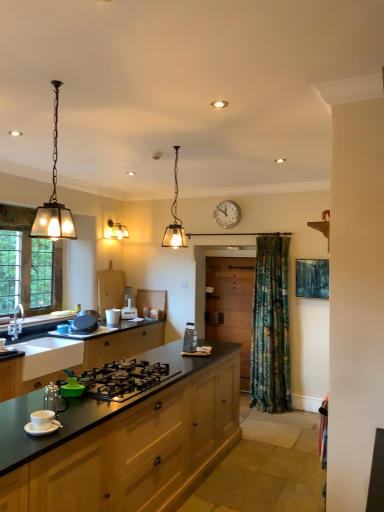
Locate an element on the screen. This screenshot has width=384, height=512. metallic silver tea pot at lower left is located at coordinates (54, 399).

What do you see at coordinates (54, 399) in the screenshot? I see `metallic silver tea pot at lower left` at bounding box center [54, 399].

You are a GUI agent. You are given a task and a screenshot of the screen. Output one action in this format:
    pyautogui.click(x=<x>, y=<y>)
    Task: Click on the white glossy cup at center, placed as the second appliance when sorted from left to right
    
    Given the screenshot: What is the action you would take?
    pyautogui.click(x=113, y=316)

What is the approximate height of white ceramic cup at lower left, acting as the second appliance starting from the right?

It is 3.08 inches.

I want to click on white plastic clock at upper center, so click(x=227, y=214).

From the picture: How many degrees apart are the facing directions of white ceramic cup at lower left, acting as the second appliance starting from the right, and brushed metal faucet at left?

The facing directions of white ceramic cup at lower left, acting as the second appliance starting from the right, and brushed metal faucet at left are 5.66 degrees apart.

From the image's perspective, is white ceramic cup at lower left, the 5th appliance from the back, over brushed metal faucet at left?

No.

In the scene shown: Which of these two, white ceramic cup at lower left, acting as the second appliance starting from the right, or brushed metal faucet at left, is thinner?

white ceramic cup at lower left, acting as the second appliance starting from the right, is thinner.

Who is bigger, white ceramic cup at lower left, which is the first appliance in front-to-back order, or brushed metal faucet at left?

brushed metal faucet at left.

Where is `sink that is behind the white ceramic cup at lower left, acting as the second appliance starting from the right`? The height and width of the screenshot is (512, 384). sink that is behind the white ceramic cup at lower left, acting as the second appliance starting from the right is located at coordinates (49, 355).

From the picture: Who is more distant, white matte sink at lower left or white ceramic cup at lower left, the 5th appliance from the back?

white matte sink at lower left.

From the image's perspective, relative to white ceramic cup at lower left, the 5th appliance from the back, is white matte sink at lower left above or below?

white matte sink at lower left is below white ceramic cup at lower left, the 5th appliance from the back.

Considering the positions of objects clear glass window at left and white plastic clock at upper center in the image provided, who is more to the right, clear glass window at left or white plastic clock at upper center?

From the viewer's perspective, white plastic clock at upper center appears more on the right side.

Between point (53, 270) and point (217, 207), which one is positioned in front?

Positioned in front is point (53, 270).

Could you tell me if clear glass window at left is facing white plastic clock at upper center?

No, clear glass window at left is not facing towards white plastic clock at upper center.

Based on the photo, does clear glass window at left lie in front of white plastic clock at upper center?

Yes, clear glass window at left is closer to the viewer.

Does satin silver grater at center, which is counted as the 5th appliance, starting from the left, have a larger size compared to white glossy cup at center, which ranks as the 4th appliance in right-to-left order?

No.

Is satin silver grater at center, the 4th appliance viewed from the back, turned away from white glossy cup at center, placed as the second appliance when sorted from left to right?

satin silver grater at center, the 4th appliance viewed from the back, does not have its back to white glossy cup at center, placed as the second appliance when sorted from left to right.

How much distance is there between satin silver grater at center, which is counted as the 5th appliance, starting from the left, and white glossy cup at center, which ranks as the 4th appliance in right-to-left order?

The distance of satin silver grater at center, which is counted as the 5th appliance, starting from the left, from white glossy cup at center, which ranks as the 4th appliance in right-to-left order, is 96.53 centimeters.

Between satin silver grater at center, which is the first appliance in right-to-left order, and white glossy cup at center, which appears as the fourth appliance when viewed from the front, which one has smaller width?

Thinner between the two is satin silver grater at center, which is the first appliance in right-to-left order.

In terms of height, does black matte gas stove at center look taller or shorter compared to white ceramic cup at lower left, arranged as the 4th appliance when viewed from the left?

black matte gas stove at center is taller than white ceramic cup at lower left, arranged as the 4th appliance when viewed from the left.

Where is `the 1st appliance above the black matte gas stove at center (from a real-world perspective)`? the 1st appliance above the black matte gas stove at center (from a real-world perspective) is located at coordinates (43, 420).

Would you consider black matte gas stove at center to be distant from white ceramic cup at lower left, arranged as the 4th appliance when viewed from the left?

No, black matte gas stove at center is in close proximity to white ceramic cup at lower left, arranged as the 4th appliance when viewed from the left.

Is matte glass pendant light at upper left, arranged as the second lamp when viewed from the left, to the right of metallic silver tea pot at lower left from the viewer's perspective?

Incorrect, matte glass pendant light at upper left, arranged as the second lamp when viewed from the left, is not on the right side of metallic silver tea pot at lower left.

Is matte glass pendant light at upper left, arranged as the second lamp when viewed from the left, placed right next to metallic silver tea pot at lower left?

No, matte glass pendant light at upper left, arranged as the second lamp when viewed from the left, is not with metallic silver tea pot at lower left.

Considering the relative sizes of matte glass pendant light at upper left, arranged as the second lamp when viewed from the left, and metallic silver tea pot at lower left in the image provided, is matte glass pendant light at upper left, arranged as the second lamp when viewed from the left, taller than metallic silver tea pot at lower left?

Correct, matte glass pendant light at upper left, arranged as the second lamp when viewed from the left, is much taller as metallic silver tea pot at lower left.

From a real-world perspective, does matte glass pendant light at upper left, marked as the 1th lamp in a right-to-left arrangement, sit lower than metallic silver tea pot at lower left?

No, from a real-world perspective, matte glass pendant light at upper left, marked as the 1th lamp in a right-to-left arrangement, is not below metallic silver tea pot at lower left.

Locate an element on the screen. the 2nd appliance positioned above the wooden cabinet at center, positioned as the 3th cabinetry in front-to-back order (from a real-world perspective) is located at coordinates (84, 324).

From a real-world perspective, is wooden cabinet at center, which ranks as the 1th cabinetry in back-to-front order, above or below matte black frying pan at left, the 1th appliance viewed from the left?

wooden cabinet at center, which ranks as the 1th cabinetry in back-to-front order, is below matte black frying pan at left, the 1th appliance viewed from the left.

Between wooden cabinet at center, positioned as the 3th cabinetry in front-to-back order, and matte black frying pan at left, the third appliance from the front, which one has larger size?

wooden cabinet at center, positioned as the 3th cabinetry in front-to-back order, is bigger.

Consider the image. Considering the sizes of objects wooden cabinet at center, positioned as the 3th cabinetry in front-to-back order, and matte black frying pan at left, the third appliance from the back, in the image provided, who is thinner, wooden cabinet at center, positioned as the 3th cabinetry in front-to-back order, or matte black frying pan at left, the third appliance from the back,?

With smaller width is wooden cabinet at center, positioned as the 3th cabinetry in front-to-back order.

The image size is (384, 512). Find the location of `the 4th appliance positioned below the brushed metal faucet at left (from a real-world perspective)`. the 4th appliance positioned below the brushed metal faucet at left (from a real-world perspective) is located at coordinates (43, 420).

Where is `sink below the white ceramic cup at lower left, arranged as the 4th appliance when viewed from the left (from the image's perspective)`? sink below the white ceramic cup at lower left, arranged as the 4th appliance when viewed from the left (from the image's perspective) is located at coordinates coord(49,355).

Estimate the real-world distances between objects in this image. Which object is further from white plastic blender at center, the third appliance viewed from the right, matte glass pendant light at center or matte glass pendant light at upper left, which ranks as the second lamp in back-to-front order?

The object further to white plastic blender at center, the third appliance viewed from the right, is matte glass pendant light at upper left, which ranks as the second lamp in back-to-front order.

Considering their positions, is matte black countertop at lower left, the 3th cabinetry in the back-to-front sequence, positioned further to matte glass pendant light at upper center, positioned as the 1th lamp in back-to-front order, than brushed metal faucet at left?

matte black countertop at lower left, the 3th cabinetry in the back-to-front sequence, is further to matte glass pendant light at upper center, positioned as the 1th lamp in back-to-front order.

From the image, which object appears to be farther from matte black countertop at lower left, the 3th cabinetry in the back-to-front sequence, satin silver grater at center, the 4th appliance viewed from the back, or white glossy cup at center, placed as the second appliance when sorted from left to right?

white glossy cup at center, placed as the second appliance when sorted from left to right, lies further to matte black countertop at lower left, the 3th cabinetry in the back-to-front sequence, than the other object.

Which object lies nearer to the anchor point matte black frying pan at left, the third appliance from the front, white glossy cup at center, which ranks as the 4th appliance in right-to-left order, or wooden cabinet at center, which ranks as the 1th cabinetry in back-to-front order?

white glossy cup at center, which ranks as the 4th appliance in right-to-left order, is closer to matte black frying pan at left, the third appliance from the front.

Estimate the real-world distances between objects in this image. Which object is closer to wooden cabinet at center, which ranks as the 1th cabinetry in back-to-front order, clear glass window at left or matte black countertop at lower left, the second cabinetry in the back-to-front sequence?

matte black countertop at lower left, the second cabinetry in the back-to-front sequence, lies closer to wooden cabinet at center, which ranks as the 1th cabinetry in back-to-front order, than the other object.

When comparing their distances from matte glass pendant light at upper left, arranged as the second lamp when viewed from the left, does white glossy cup at center, placed as the second appliance when sorted from left to right, or matte glass pendant light at center seem further?

white glossy cup at center, placed as the second appliance when sorted from left to right, lies further to matte glass pendant light at upper left, arranged as the second lamp when viewed from the left, than the other object.

When comparing their distances from matte glass pendant light at upper center, positioned as the 1th lamp in back-to-front order, does matte glass pendant light at center or matte glass pendant light at upper left, arranged as the second lamp when viewed from the left, seem further?

matte glass pendant light at upper left, arranged as the second lamp when viewed from the left, is positioned further to the anchor matte glass pendant light at upper center, positioned as the 1th lamp in back-to-front order.

When comparing their distances from satin silver grater at center, which is counted as the 5th appliance, starting from the left, does white ceramic cup at lower left, which is the first appliance in front-to-back order, or white matte sink at lower left seem closer?

Based on the image, white matte sink at lower left appears to be nearer to satin silver grater at center, which is counted as the 5th appliance, starting from the left.

You are a GUI agent. You are given a task and a screenshot of the screen. Output one action in this format:
    pyautogui.click(x=<x>, y=<y>)
    Task: Click on the gas stove between matte glass pendant light at center and matte black countertop at lower left, the second cabinetry positioned from the front, in the up-down direction
    The height and width of the screenshot is (512, 384).
    Given the screenshot: What is the action you would take?
    [123, 379]

The width and height of the screenshot is (384, 512). I want to click on clock positioned between white ceramic cup at lower left, the 5th appliance from the back, and wooden cabinet at center, which ranks as the 1th cabinetry in back-to-front order, from near to far, so click(x=227, y=214).

Image resolution: width=384 pixels, height=512 pixels. In order to click on gas stove between matte glass pendant light at upper left, the first lamp viewed from the front, and white plastic blender at center, the third appliance viewed from the right, along the z-axis in this screenshot , I will do `click(123, 379)`.

I want to click on window between white ceramic cup at lower left, arranged as the 4th appliance when viewed from the left, and white glossy cup at center, the 2th appliance in the back-to-front sequence, in the front-back direction, so click(32, 259).